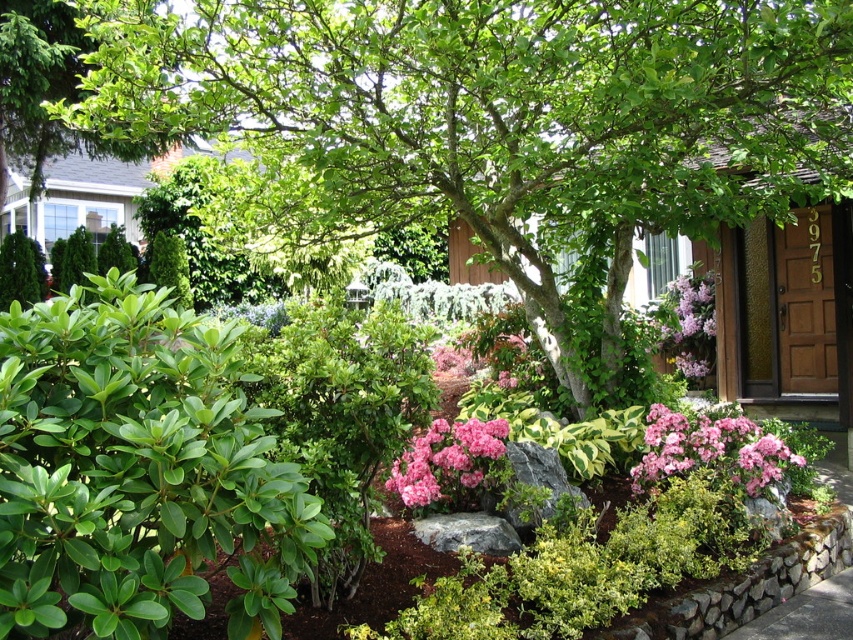
Question: Considering the real-world distances, which object is farthest from the green leafy tree at center?

Choices:
 (A) pink matte flower at lower right
 (B) green glossy shrub at lower left
 (C) pink matte flower at center

Answer: (B)

Question: Can you confirm if pink matte flower at lower right is smaller than pink matte flower at center?

Choices:
 (A) no
 (B) yes

Answer: (A)

Question: Is green glossy shrub at lower left closer to the viewer compared to pink matte flower at lower right?

Choices:
 (A) yes
 (B) no

Answer: (A)

Question: Among these points, which one is nearest to the camera?

Choices:
 (A) (496, 115)
 (B) (680, 301)

Answer: (A)

Question: Which of these objects is positioned closest to the pink matte flower at center?

Choices:
 (A) pink matte flower at lower right
 (B) green leafy tree at center
 (C) purple matte flowers at center-right

Answer: (A)

Question: Is green leafy tree at center above pink matte flower at lower right?

Choices:
 (A) yes
 (B) no

Answer: (A)